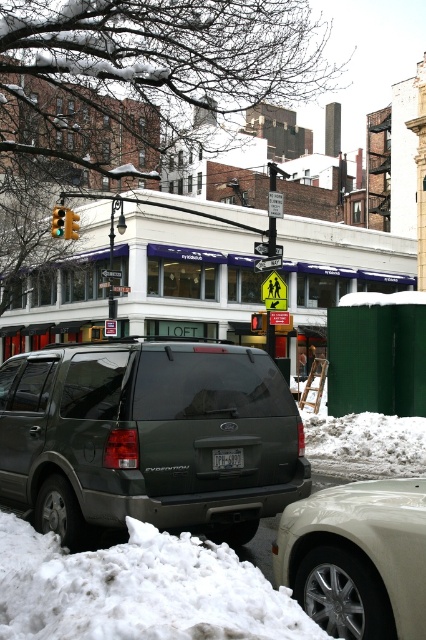
Question: Based on their relative distances, which object is farther from the yellow plastic traffic light at upper center?

Choices:
 (A) white fluffy snow at lower left
 (B) red glass traffic light at center

Answer: (A)

Question: Is black plastic license plate at rear behind yellow glass traffic light at upper left?

Choices:
 (A) yes
 (B) no

Answer: (B)

Question: Is yellowmaterial/texturestreet sign at center above metallic reflective street sign at center?

Choices:
 (A) no
 (B) yes

Answer: (B)

Question: Which of the following is the closest to the observer?

Choices:
 (A) tap(51, 216)
 (B) tap(250, 324)
 (C) tap(275, 257)

Answer: (C)

Question: From the image, what is the correct spatial relationship of yellow glass traffic light at upper left in relation to yellow reflective plastic pedestrian crossing sign at center?

Choices:
 (A) left
 (B) right

Answer: (A)

Question: Which of the following is the closest to the observer?

Choices:
 (A) black plastic license plate at rear
 (B) yellowmaterial/texturestreet sign at center
 (C) white metallic sedan at lower right

Answer: (C)